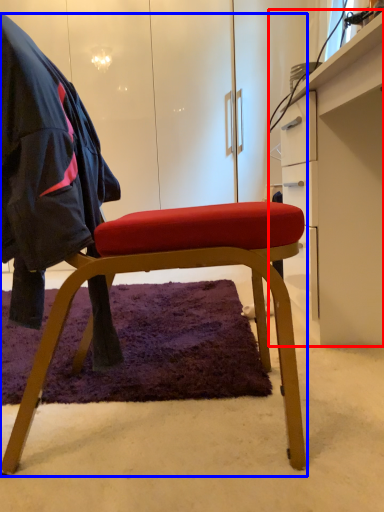
Question: Which object is closer to the camera taking this photo, desk (highlighted by a red box) or chair (highlighted by a blue box)?

Choices:
 (A) desk
 (B) chair

Answer: (B)